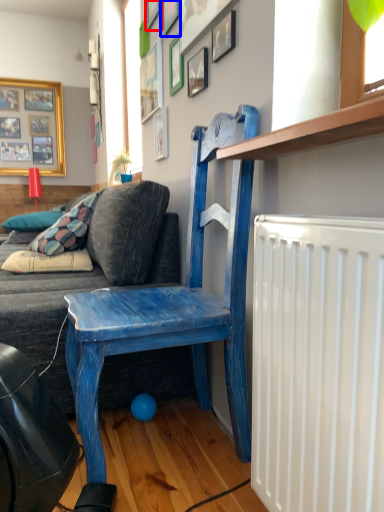
Question: Which of the following is the farthest to the observer, picture frame (highlighted by a red box) or picture frame (highlighted by a blue box)?

Choices:
 (A) picture frame
 (B) picture frame

Answer: (A)